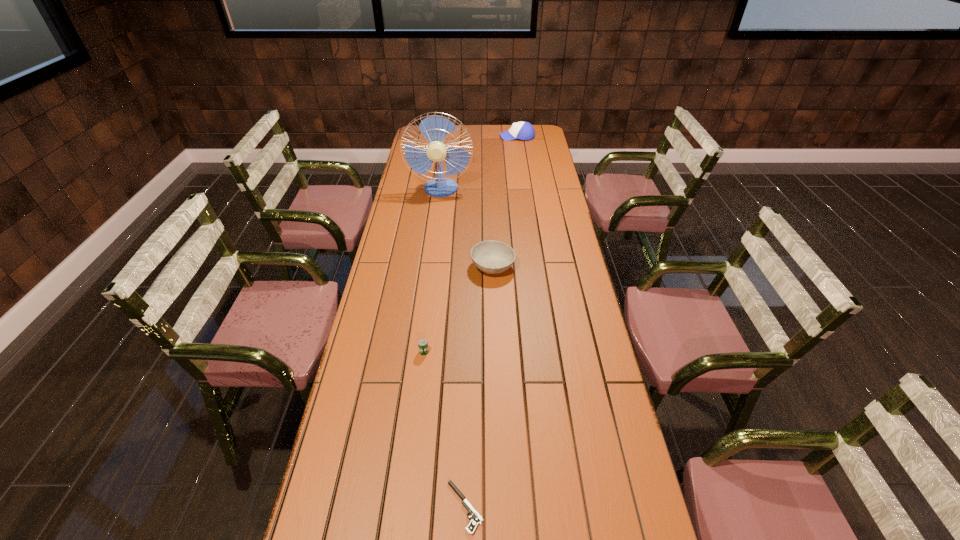
You are a GUI agent. You are given a task and a screenshot of the screen. Output one action in this format:
    pyautogui.click(x=<x>, y=<y>)
    Task: Click on the second farthest object
    Image resolution: width=960 pixels, height=540 pixels.
    Given the screenshot: What is the action you would take?
    434,128

Find the location of a particular element. the tallest object is located at coordinates (434, 128).

You are a GUI agent. You are given a task and a screenshot of the screen. Output one action in this format:
    pyautogui.click(x=<x>, y=<y>)
    Task: Click on the second tallest object
    This screenshot has width=960, height=540.
    Given the screenshot: What is the action you would take?
    pyautogui.click(x=522, y=130)

At what (x,y) coordinates should I click in order to perform the action: click on the farthest object. Please return your answer as a coordinate pair (x, y). The image size is (960, 540). Looking at the image, I should click on (522, 130).

Locate an element on the screen. the third shortest object is located at coordinates (492, 257).

Where is `bowl`? This screenshot has height=540, width=960. bowl is located at coordinates (492, 257).

I want to click on the fourth tallest object, so click(x=422, y=343).

Where is `the fourth farthest object`? The width and height of the screenshot is (960, 540). the fourth farthest object is located at coordinates (422, 343).

The image size is (960, 540). I want to click on the shortest object, so click(476, 519).

The height and width of the screenshot is (540, 960). I want to click on pistol, so click(476, 519).